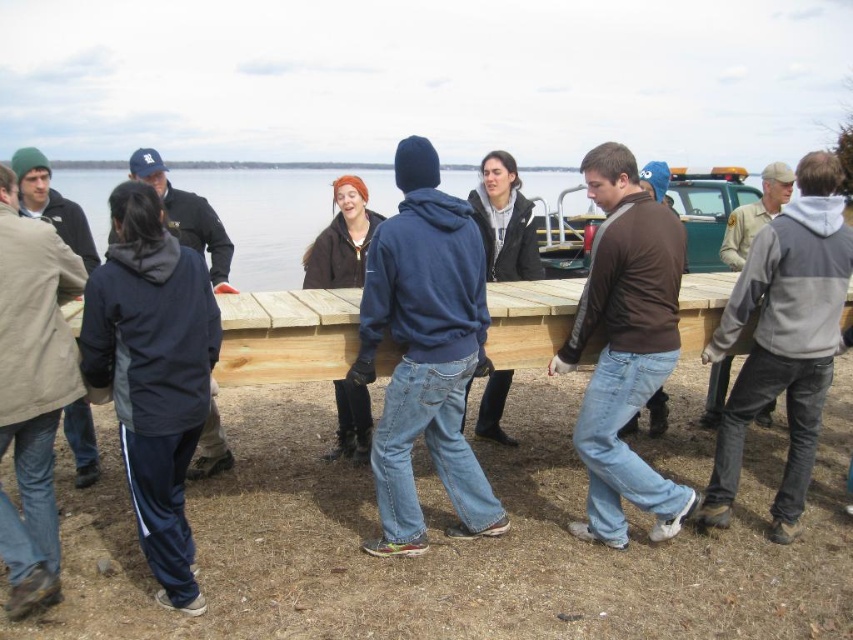
Question: Can you confirm if brown cotton shirt at center is positioned below brown fuzzy coat at center?

Choices:
 (A) yes
 (B) no

Answer: (A)

Question: Among these points, which one is nearest to the camera?

Choices:
 (A) (793, 496)
 (B) (39, 211)
 (C) (653, 506)

Answer: (C)

Question: Is brown fuzzy coat at center to the right of khaki uniform shirt at right from the viewer's perspective?

Choices:
 (A) yes
 (B) no

Answer: (B)

Question: Is dark blue jacket at left wider than beige woolen jacket at left?

Choices:
 (A) yes
 (B) no

Answer: (A)

Question: Which point is closer to the camera taking this photo?

Choices:
 (A) (711, 499)
 (B) (206, 458)
 (C) (787, 170)
 (D) (184, 566)

Answer: (D)

Question: Which object appears farthest from the camera in this image?

Choices:
 (A) gray/white hoodie at right
 (B) beige woolen jacket at left

Answer: (B)